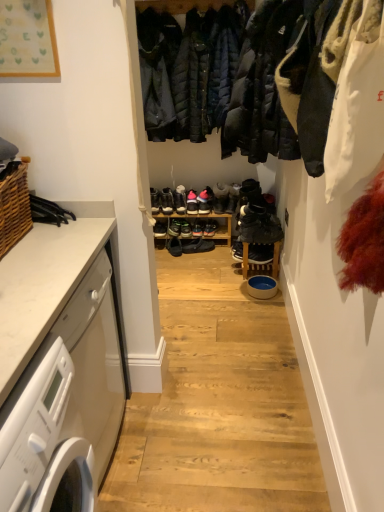
What are the coordinates of `blank space situated above pink suede sneakers at center, the 6th footwear viewed from the left (from a real-world perspective)` in the screenshot? It's located at (212, 195).